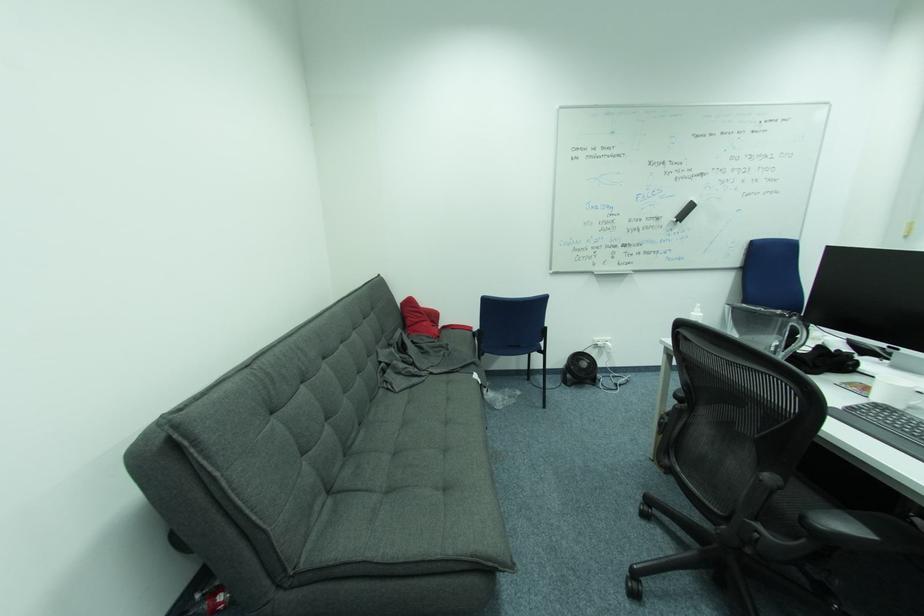
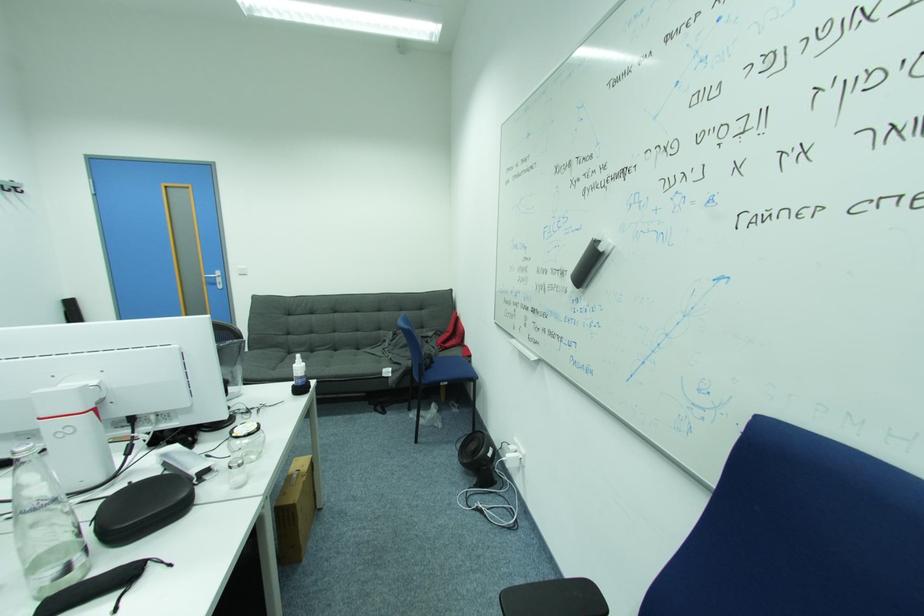
Where in the second image is the point corresponding to pixel 385 371 from the first image?

(388, 341)